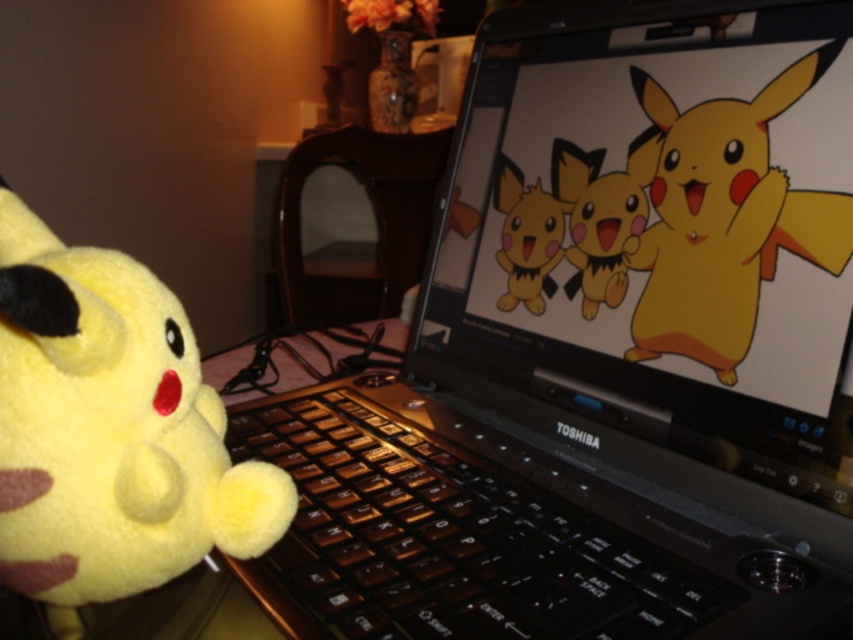
Is point (579, 589) positioned in front of point (204, 428)?

Yes, it is in front of point (204, 428).

Is brown matte keyboard at center wider than fluffy yellow plush at left?

Yes, brown matte keyboard at center is wider than fluffy yellow plush at left.

Is point (664, 595) positioned behind point (0, 179)?

No.

Find the location of a particular element. Image resolution: width=853 pixels, height=640 pixels. brown matte keyboard at center is located at coordinates (447, 532).

Is point (111, 600) positioned after point (701, 209)?

No, it is in front of (701, 209).

Does fluffy yellow plush at left appear on the right side of yellow plush toy at center?

In fact, fluffy yellow plush at left is to the left of yellow plush toy at center.

The height and width of the screenshot is (640, 853). I want to click on fluffy yellow plush at left, so click(109, 432).

Locate an element on the screen. The image size is (853, 640). fluffy yellow plush at left is located at coordinates (109, 432).

Is brown matte keyboard at center shorter than yellow plush toy at center?

Yes, brown matte keyboard at center is shorter than yellow plush toy at center.

Which of these two, brown matte keyboard at center or yellow plush toy at center, stands taller?

yellow plush toy at center is taller.

Who is more forward, [402,428] or [640,134]?

Point [640,134] is more forward.

Where is `brown matte keyboard at center`? Image resolution: width=853 pixels, height=640 pixels. brown matte keyboard at center is located at coordinates (447, 532).